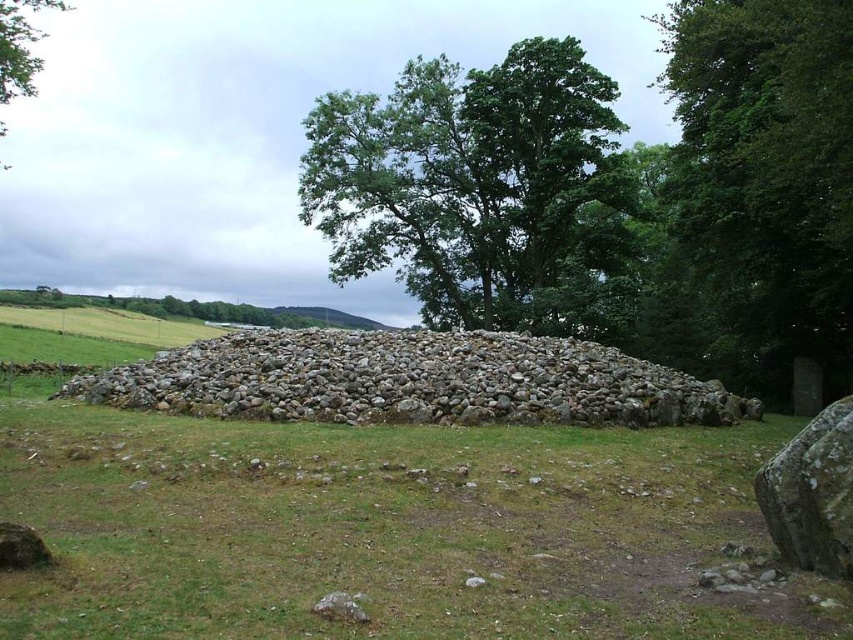
From the picture: Who is more forward, (430, 99) or (630, 408)?

Positioned in front is point (630, 408).

Is green leafy tree at upper center to the left of gray stone pile at center from the viewer's perspective?

Indeed, green leafy tree at upper center is positioned on the left side of gray stone pile at center.

Who is more distant from viewer, (358, 170) or (466, 380)?

Positioned behind is point (358, 170).

The height and width of the screenshot is (640, 853). Find the location of `green leafy tree at upper center`. green leafy tree at upper center is located at coordinates (473, 182).

Can you confirm if gray stone pile at center is shorter than green leafy tree at upper left?

Yes, gray stone pile at center is shorter than green leafy tree at upper left.

Which of these two, gray stone pile at center or green leafy tree at upper left, stands taller?

green leafy tree at upper left is taller.

Does point (329, 337) come in front of point (25, 8)?

Yes, point (329, 337) is closer to viewer.

In order to click on gray stone pile at center in this screenshot , I will do `click(410, 380)`.

This screenshot has height=640, width=853. What do you see at coordinates (767, 177) in the screenshot? I see `green leafy tree at right` at bounding box center [767, 177].

Who is shorter, green leafy tree at right or green leafy tree at upper left?

With less height is green leafy tree at right.

Where is `green leafy tree at right`? Image resolution: width=853 pixels, height=640 pixels. green leafy tree at right is located at coordinates (767, 177).

Locate an element on the screen. green leafy tree at right is located at coordinates (767, 177).